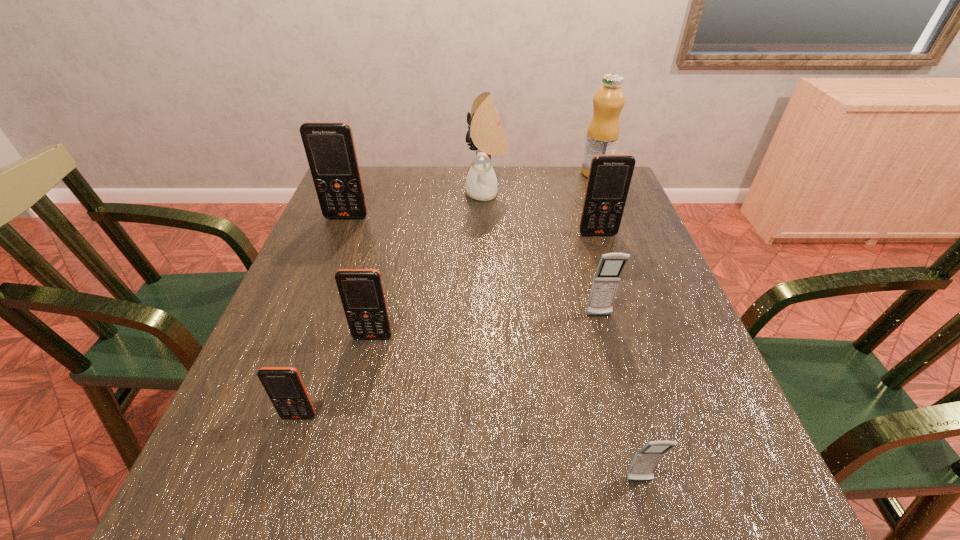
Where is `free space that is in between the fruit juice and the fifth farthest object`? free space that is in between the fruit juice and the fifth farthest object is located at coordinates (597, 244).

Find the location of a particular element. The height and width of the screenshot is (540, 960). free point between the farthest orange cellular telephone and the fifth nearest cellular telephone is located at coordinates (472, 225).

Where is `vacant point located between the fruit juice and the third nearest cellular telephone`? This screenshot has height=540, width=960. vacant point located between the fruit juice and the third nearest cellular telephone is located at coordinates (484, 255).

Identify which object is the nearest to the farther gray cellular telephone. Please provide its 2D coordinates. Your answer should be formatted as a tuple, i.e. [(x, y)], where the tuple contains the x and y coordinates of a point satisfying the conditions above.

[(609, 179)]

Locate which object ranks seventh in proximity to the black doll. Please provide its 2D coordinates. Your answer should be formatted as a tuple, i.e. [(x, y)], where the tuple contains the x and y coordinates of a point satisfying the conditions above.

[(646, 460)]

This screenshot has width=960, height=540. Find the location of `cellular telephone that is the third closest to the doll`. cellular telephone that is the third closest to the doll is located at coordinates (606, 280).

The height and width of the screenshot is (540, 960). Identify the location of the second closest cellular telephone to the bigger gray cellular telephone. (646, 460).

You are a GUI agent. You are given a task and a screenshot of the screen. Output one action in this format:
    pyautogui.click(x=<x>, y=<y>)
    Task: Click on the orange cellular telephone identified as the third closest to the second tallest cellular telephone
    
    Given the screenshot: What is the action you would take?
    pyautogui.click(x=283, y=385)

Locate an element on the screen. orange cellular telephone that is the closest to the nearest object is located at coordinates (361, 291).

Find the location of a particular element. The height and width of the screenshot is (540, 960). blank area in the image that satisfies the following two spatial constraints: 1. on the front label of the fruit juice; 2. on the screen of the fifth farthest cellular telephone is located at coordinates (691, 416).